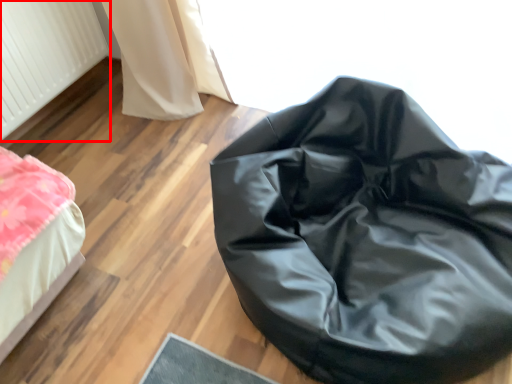
Question: Considering the relative positions of radiator (annotated by the red box) and furniture in the image provided, where is radiator (annotated by the red box) located with respect to the staircase?

Choices:
 (A) left
 (B) right

Answer: (A)